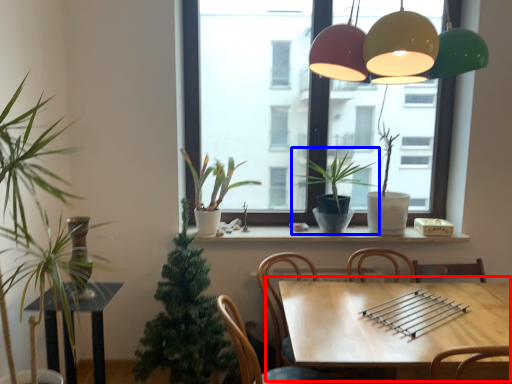
Question: Which object appears farthest to the camera in this image, table (highlighted by a red box) or houseplant (highlighted by a blue box)?

Choices:
 (A) table
 (B) houseplant

Answer: (B)